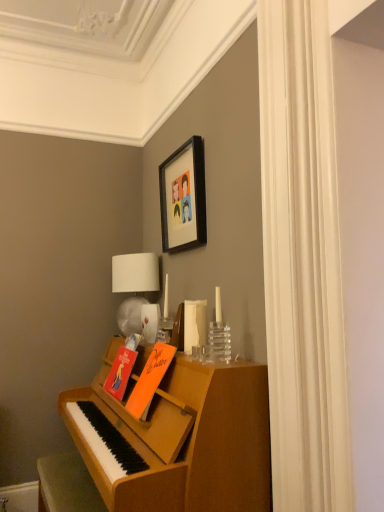
Question: Would you consider wooden piano at lower left to be distant from orange matte book at center, which appears as the 2th book when viewed from the front?

Choices:
 (A) yes
 (B) no

Answer: (B)

Question: Is wooden piano at lower left with orange matte book at center, arranged as the first book when viewed from the back?

Choices:
 (A) no
 (B) yes

Answer: (A)

Question: Would you say wooden piano at lower left is outside orange matte book at center, which appears as the 2th book when viewed from the front?

Choices:
 (A) yes
 (B) no

Answer: (A)

Question: From the image's perspective, does wooden piano at lower left appear lower than orange matte book at center, arranged as the first book when viewed from the back?

Choices:
 (A) yes
 (B) no

Answer: (A)

Question: Can you confirm if wooden piano at lower left is smaller than orange matte book at center, arranged as the first book when viewed from the back?

Choices:
 (A) no
 (B) yes

Answer: (A)

Question: Is black matte picture frame at upper center to the left or to the right of orange matte book at center, the second book positioned from the back, in the image?

Choices:
 (A) right
 (B) left

Answer: (A)

Question: Is black matte picture frame at upper center situated inside orange matte book at center, the second book positioned from the back, or outside?

Choices:
 (A) inside
 (B) outside

Answer: (B)

Question: Looking at their shapes, would you say black matte picture frame at upper center is wider or thinner than orange matte book at center, the second book positioned from the back?

Choices:
 (A) thin
 (B) wide

Answer: (A)

Question: Is black matte picture frame at upper center taller or shorter than orange matte book at center, the second book positioned from the back?

Choices:
 (A) short
 (B) tall

Answer: (B)

Question: Is wooden piano at lower left in front of or behind white fabric lampshade at upper center in the image?

Choices:
 (A) behind
 (B) front

Answer: (B)

Question: From the image's perspective, relative to white fabric lampshade at upper center, is wooden piano at lower left above or below?

Choices:
 (A) below
 (B) above

Answer: (A)

Question: In terms of width, does wooden piano at lower left look wider or thinner when compared to white fabric lampshade at upper center?

Choices:
 (A) thin
 (B) wide

Answer: (B)

Question: From a real-world perspective, is wooden piano at lower left physically located above or below white fabric lampshade at upper center?

Choices:
 (A) above
 (B) below

Answer: (B)

Question: Considering the positions of point (150, 283) and point (142, 412), is point (150, 283) closer or farther from the camera than point (142, 412)?

Choices:
 (A) farther
 (B) closer

Answer: (A)

Question: Choose the correct answer: Is white fabric lampshade at upper center inside orange matte book at center, the second book positioned from the back, or outside it?

Choices:
 (A) outside
 (B) inside

Answer: (A)